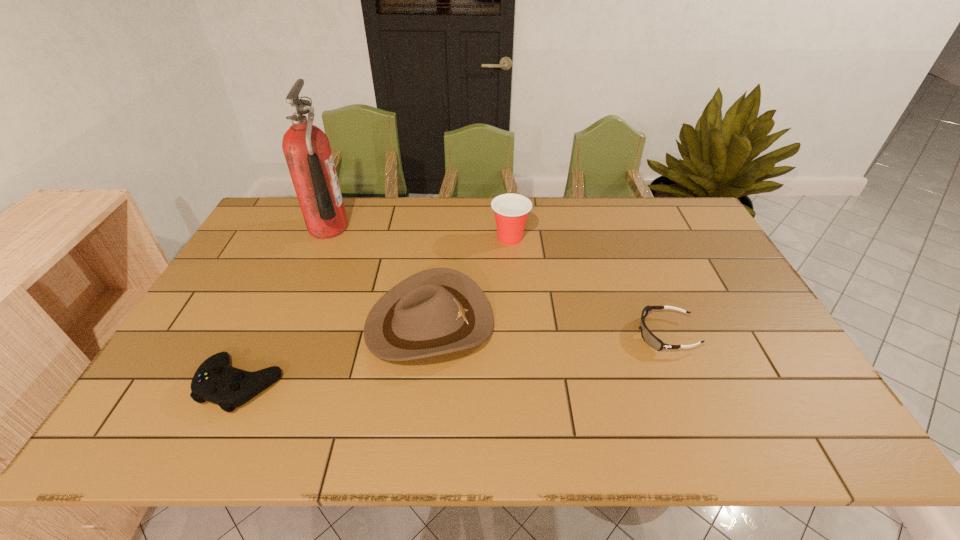
Where is `unoccupied area between the control and the fire extinguisher`? unoccupied area between the control and the fire extinguisher is located at coordinates (284, 306).

This screenshot has width=960, height=540. In order to click on the second closest object to the cowboy hat in this screenshot , I will do point(215,381).

Point out which object is positioned as the fourth nearest to the tallest object. Please provide its 2D coordinates. Your answer should be formatted as a tuple, i.e. [(x, y)], where the tuple contains the x and y coordinates of a point satisfying the conditions above.

[(648, 337)]

I want to click on vacant space that satisfies the following two spatial constraints: 1. on the front and sides of the goggles; 2. on the front side of the fourth tallest object, so click(686, 384).